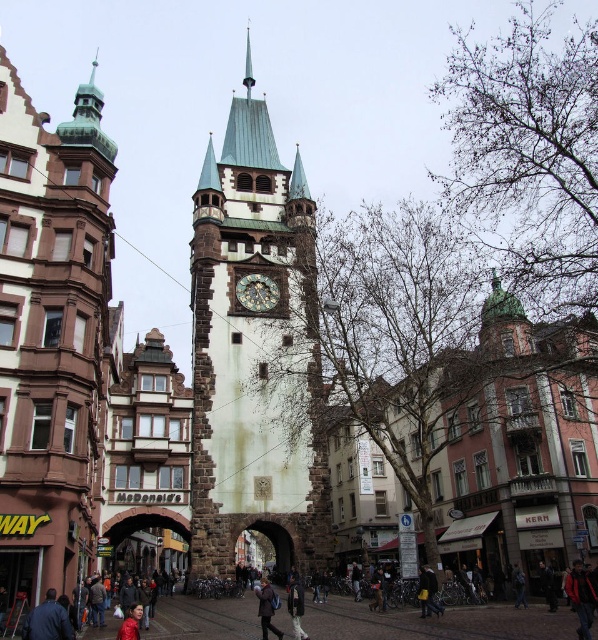
You are a tourist standing in front of the historic stone tower with a clock face. You notice two clocks in the scene. Which clock is bigger? The stone clock tower at center or the dark brown wooden clock at center?

The stone clock tower at center is larger in size compared to the dark brown wooden clock at center.

You are standing at the point with coordinates point (258, 308) in the scene. You want to walk towards the historic stone tower with the clock face. Will the point with coordinates point (299, 216) block your path?

Point (299, 216) is behind point (258, 308), so it will not block your path to the historic stone tower with the clock face.